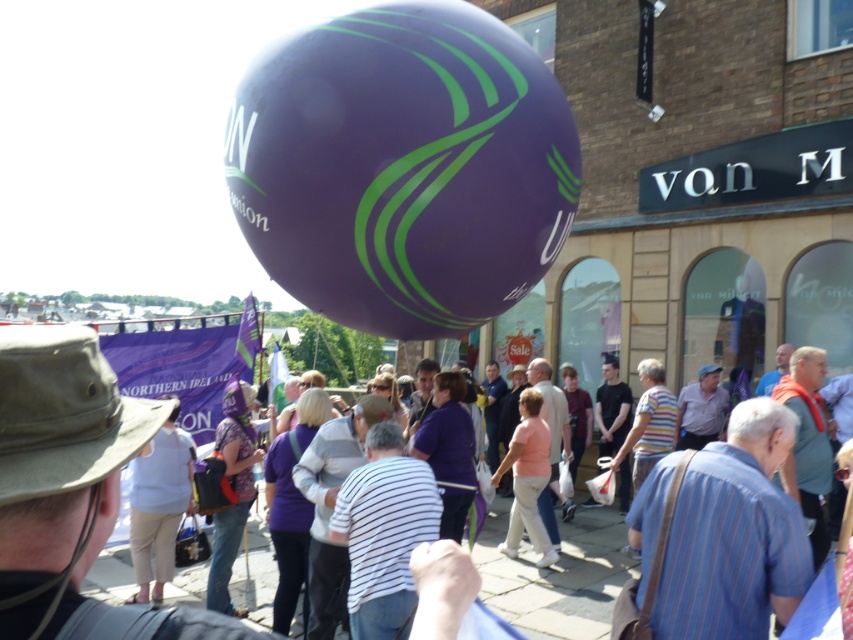
Question: Does purple glossy balloon at center appear under purple fabric crowd at center?

Choices:
 (A) yes
 (B) no

Answer: (B)

Question: Which object is positioned farthest from the purple glossy balloon at center?

Choices:
 (A) light blue cotton shirt at center
 (B) purple fabric crowd at center

Answer: (A)

Question: Is the position of purple glossy balloon at center more distant than that of purple fabric crowd at center?

Choices:
 (A) no
 (B) yes

Answer: (B)

Question: Which object is closer to the camera taking this photo?

Choices:
 (A) purple glossy balloon at center
 (B) light blue cotton shirt at center
 (C) purple fabric crowd at center

Answer: (C)

Question: Is purple glossy balloon at center smaller than purple fabric crowd at center?

Choices:
 (A) yes
 (B) no

Answer: (A)

Question: Which point appears farthest from the camera in this image?

Choices:
 (A) (167, 636)
 (B) (181, 506)
 (C) (434, 100)

Answer: (B)